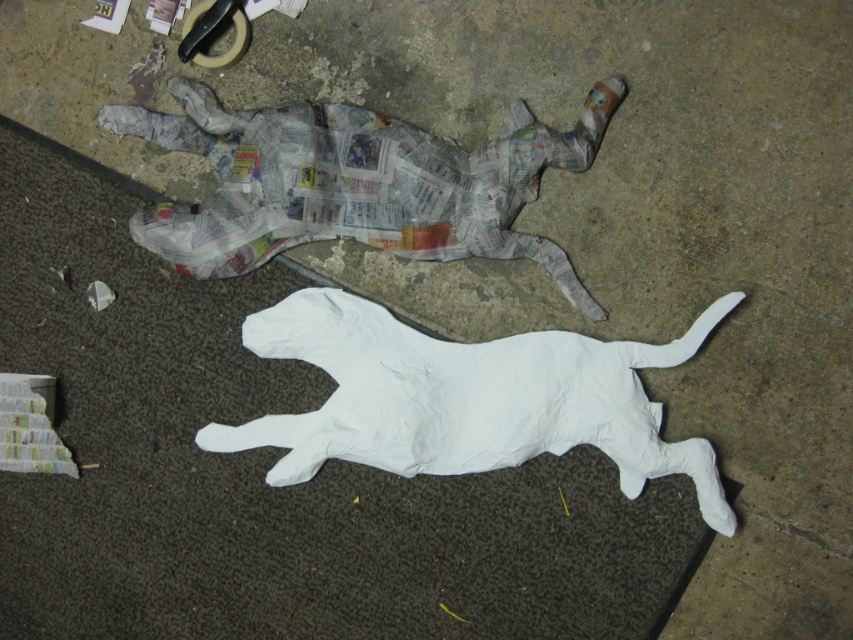
Question: Which point is closer to the camera taking this photo?

Choices:
 (A) (136, 212)
 (B) (215, 28)

Answer: (A)

Question: Which point is closer to the camera taking this photo?

Choices:
 (A) (210, 60)
 (B) (282, 481)

Answer: (B)

Question: Can you confirm if white paper dog at center is smaller than newspaper-covered dog at upper center?

Choices:
 (A) no
 (B) yes

Answer: (A)

Question: Observing the image, what is the correct spatial positioning of newspaper-covered dog at upper center in reference to matte black tape at upper center?

Choices:
 (A) left
 (B) right

Answer: (B)

Question: Which object is closer to the camera taking this photo?

Choices:
 (A) white paper dog at center
 (B) matte black tape at upper center
 (C) newspaper-covered dog at upper center

Answer: (A)

Question: From the image, what is the correct spatial relationship of white paper dog at center in relation to matte black tape at upper center?

Choices:
 (A) below
 (B) above

Answer: (A)